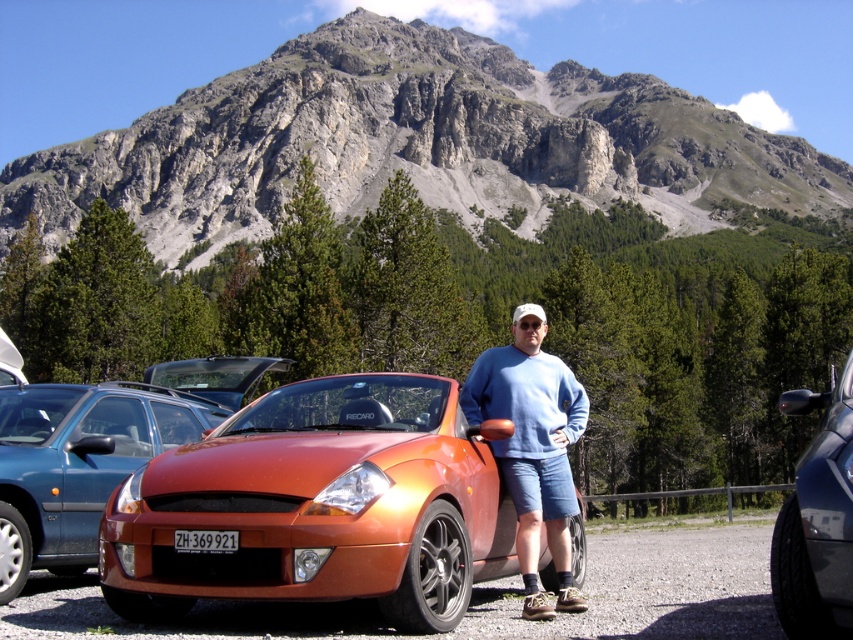
You are standing at the point with coordinates point (651, 586). What object are you facing?

The point (651, 586) corresponds to the metallic orange car at center.

You are an autonomous vehicle navigating the scene described. The metallic orange car at center is located at coordinates 0.916, 0.764. If you need to park your vehicle in a spot that requires avoiding this car, which direction should you steer to ensure you don not collide with it?

To avoid colliding with the metallic orange car at center, you should steer in a direction away from its coordinates. Since the car is at point (651,586), moving your vehicle towards lower x or y values would place you to the left or below the car, respectively, ensuring a safe distance.

You are standing at the point marked by the coordinates point (651, 586) in the image. What object is located at this point?

The point (651, 586) indicates the metallic orange car at center.